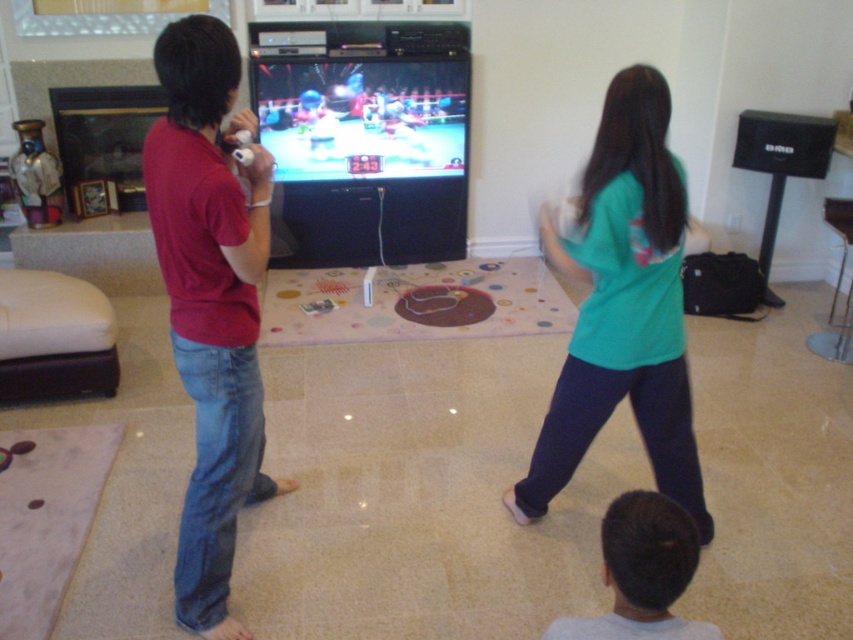
You are a delivery robot in the living room. You need to deliver a package to the dark brown hair at lower center. The matte red shirt at left is blocking your path. Can you go around them? Please explain why.

The matte red shirt at left is 1.00 meters away from the dark brown hair at lower center. Since the distance between them is 1 meter, the delivery robot can navigate around the matte red shirt at left to reach the dark brown hair at lower center as there is enough space to maneuver.

You are standing in the living room and want to move to the point marked at coordinates [260,198]. There are two people playing a video game in front of you. Can you walk through the space between them to reach the point?

The point marked at coordinates [260,198] is 6.00 feet away from you. Since the two people are actively playing a motion controlled game, there might not be enough space between them to walk through safely. It is recommended to find an alternative path or wait for a better opportunity.